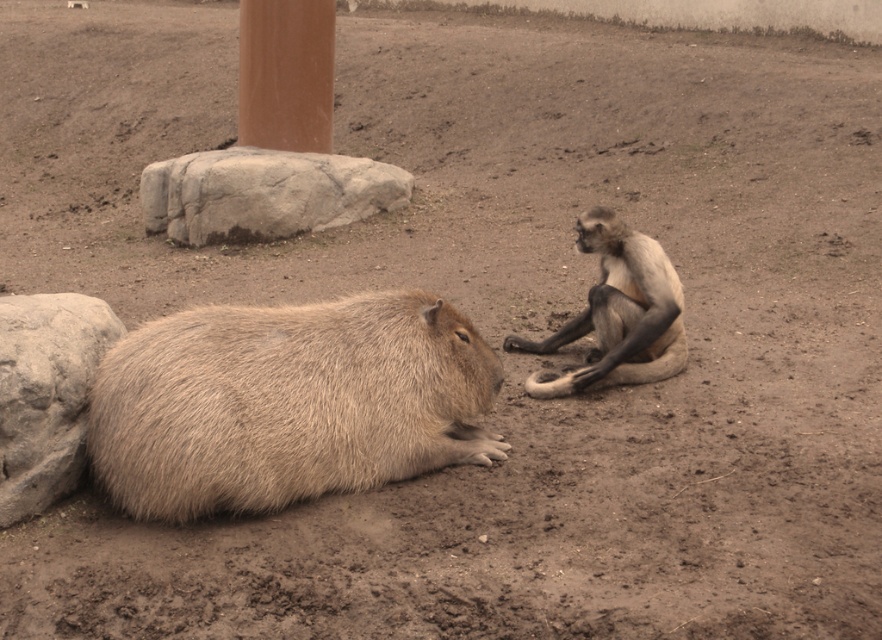
Question: Which object is farther from the camera taking this photo?

Choices:
 (A) gray rough rock at lower left
 (B) gray furry monkey at right

Answer: (B)

Question: Is fuzzy brown capybara at lower left to the left of gray rough rock at lower left from the viewer's perspective?

Choices:
 (A) no
 (B) yes

Answer: (A)

Question: Which object appears farthest from the camera in this image?

Choices:
 (A) brown polished stone pillar at upper center
 (B) gray rough rock at lower left
 (C) gray furry monkey at right

Answer: (A)

Question: Can you confirm if gray furry monkey at right is thinner than brown polished stone pillar at upper center?

Choices:
 (A) yes
 (B) no

Answer: (B)

Question: Estimate the real-world distances between objects in this image. Which object is farther from the gray rough rock at center?

Choices:
 (A) gray furry monkey at right
 (B) gray rough rock at lower left

Answer: (B)

Question: Is gray rough rock at lower left below brown polished stone pillar at upper center?

Choices:
 (A) no
 (B) yes

Answer: (B)